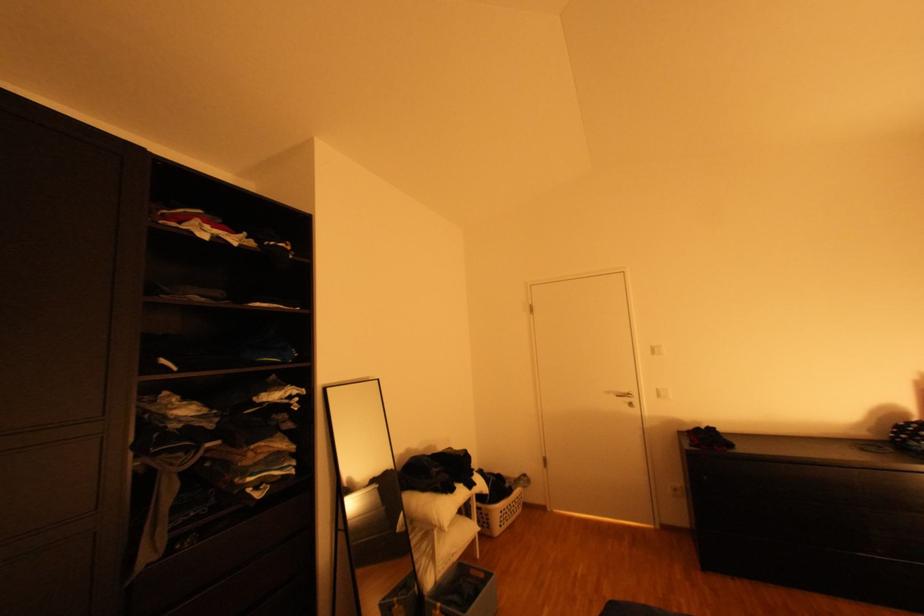
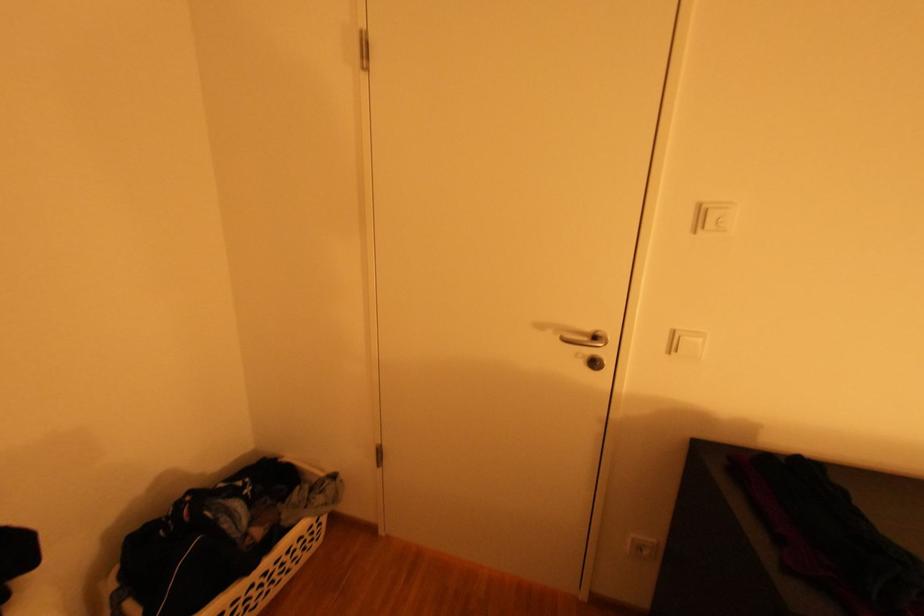
The images are taken continuously from a first-person perspective. In which direction are you moving?

The cameraman moved toward right, forward.